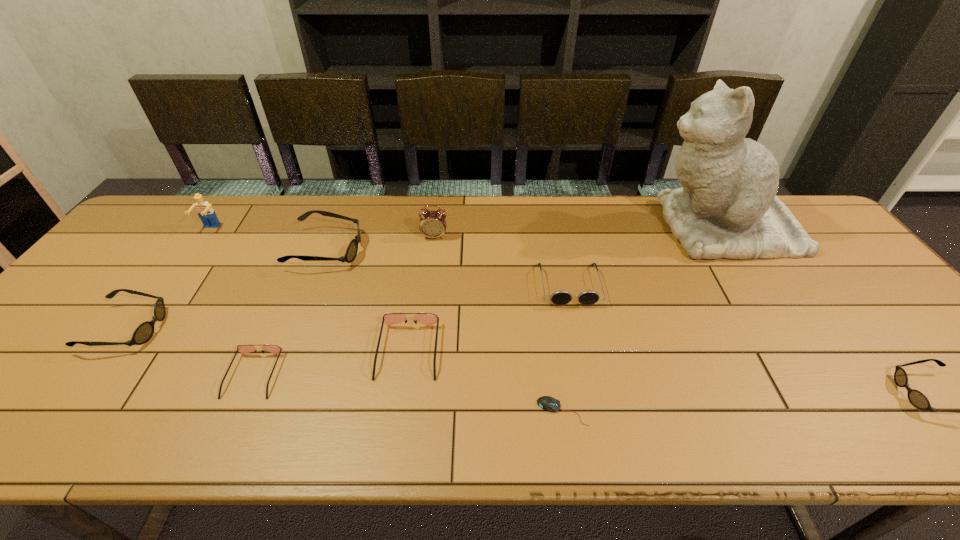
The height and width of the screenshot is (540, 960). In order to click on vacant space that satisfies the following two spatial constraints: 1. on the face of the shortest object; 2. on the left side of the blue Lego in this screenshot , I will do `click(80, 411)`.

Where is `vacant space that satisfies the following two spatial constraints: 1. on the front-facing side of the cat; 2. on the face of the blue Lego`? vacant space that satisfies the following two spatial constraints: 1. on the front-facing side of the cat; 2. on the face of the blue Lego is located at coordinates (722, 229).

I want to click on vacant space that satisfies the following two spatial constraints: 1. on the back side of the black mouse; 2. on the lenses of the leftmost sunglasses, so click(x=550, y=328).